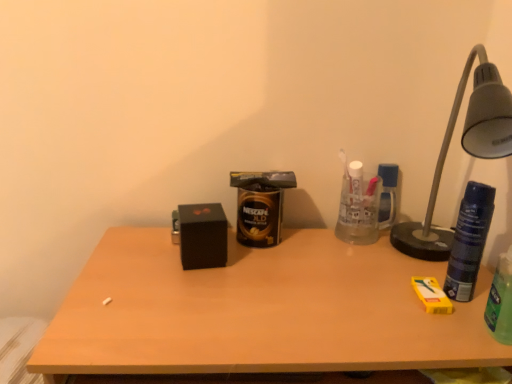
Question: Can you confirm if metallic gray lamp at right is shorter than black matte box at center?

Choices:
 (A) no
 (B) yes

Answer: (A)

Question: Could you tell me if metallic gray lamp at right is turned towards black matte box at center?

Choices:
 (A) no
 (B) yes

Answer: (A)

Question: Can you confirm if metallic gray lamp at right is taller than black matte box at center?

Choices:
 (A) yes
 (B) no

Answer: (A)

Question: Considering the relative sizes of metallic gray lamp at right and black matte box at center in the image provided, is metallic gray lamp at right bigger than black matte box at center?

Choices:
 (A) yes
 (B) no

Answer: (A)

Question: Is metallic gray lamp at right at the left side of black matte box at center?

Choices:
 (A) no
 (B) yes

Answer: (A)

Question: Considering the relative positions of metallic gray lamp at right and black matte box at center in the image provided, is metallic gray lamp at right to the right of black matte box at center from the viewer's perspective?

Choices:
 (A) yes
 (B) no

Answer: (A)

Question: Is metallic gray lamp at right positioned in front of gold metallic can at center, marked as the third beverage in a right-to-left arrangement?

Choices:
 (A) yes
 (B) no

Answer: (A)

Question: Is metallic gray lamp at right positioned with its back to gold metallic can at center, the 1th beverage positioned from the back?

Choices:
 (A) no
 (B) yes

Answer: (A)

Question: Could gold metallic can at center, marked as the third beverage in a right-to-left arrangement, be considered to be inside metallic gray lamp at right?

Choices:
 (A) no
 (B) yes

Answer: (A)

Question: Does metallic gray lamp at right turn towards gold metallic can at center, the 1th beverage in the left-to-right sequence?

Choices:
 (A) yes
 (B) no

Answer: (B)

Question: From the image's perspective, is metallic gray lamp at right above gold metallic can at center, the 1th beverage positioned from the back?

Choices:
 (A) yes
 (B) no

Answer: (A)

Question: Can you confirm if metallic gray lamp at right is thinner than gold metallic can at center, the 1th beverage positioned from the back?

Choices:
 (A) no
 (B) yes

Answer: (A)

Question: Could wooden desk at center be considered to be inside metallic gray lamp at right?

Choices:
 (A) yes
 (B) no

Answer: (B)